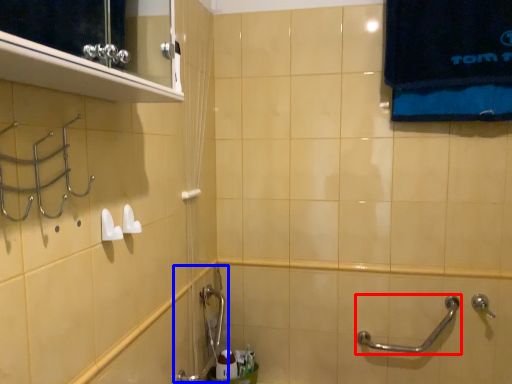
Question: Which object appears closest to the camera in this image, door handle (highlighted by a red box) or plumbing fixture (highlighted by a blue box)?

Choices:
 (A) door handle
 (B) plumbing fixture

Answer: (B)